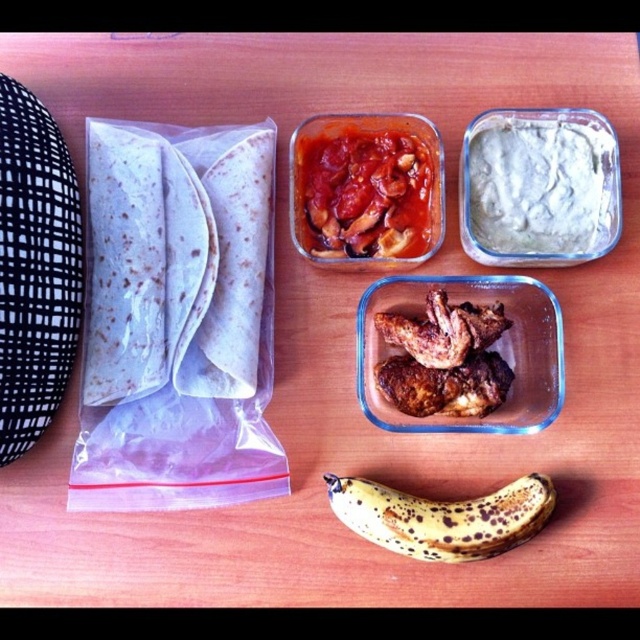
Between point (97, 147) and point (531, 509), which one is positioned in front?

Point (531, 509) is in front.

I want to click on white flour tortillas at left, so click(x=176, y=260).

Is point (227, 212) farther from camera compared to point (353, 256)?

No, it is not.

Is white flour tortillas at left shorter than tomato-based sauce at center?

No.

Identify the location of white flour tortillas at left. (176, 260).

This screenshot has width=640, height=640. Find the location of `white flour tortillas at left`. white flour tortillas at left is located at coordinates [176, 260].

Is point (259, 316) farther from viewer compared to point (541, 182)?

No, it is not.

Who is more distant from viewer, (138, 188) or (476, 132)?

The point (476, 132) is more distant.

Measure the distance between point (x=147, y=243) and camera.

The distance of point (x=147, y=243) from camera is 34.48 inches.

This screenshot has width=640, height=640. What are the coordinates of `white flour tortillas at left` in the screenshot? It's located at (176, 260).